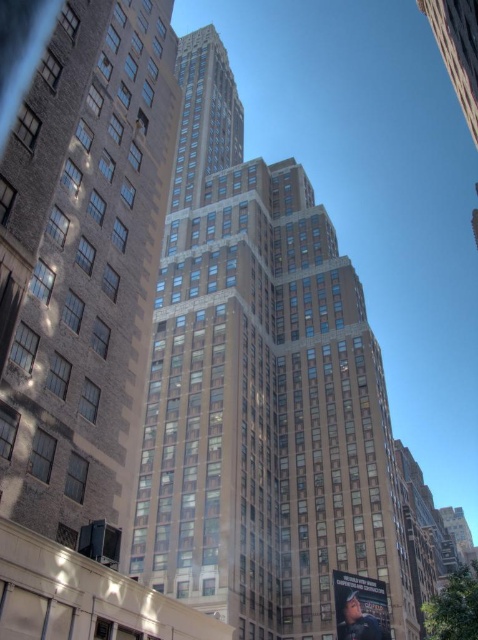
Is brown stone building at center behind brown brick building at left?

Yes, brown stone building at center is behind brown brick building at left.

From the picture: Does brown stone building at center have a greater width compared to brown brick building at left?

Indeed, brown stone building at center has a greater width compared to brown brick building at left.

Between point (327, 285) and point (140, 38), which one is positioned in front?

Point (140, 38) is in front.

Where is `brown stone building at center`? Image resolution: width=478 pixels, height=640 pixels. brown stone building at center is located at coordinates tap(260, 392).